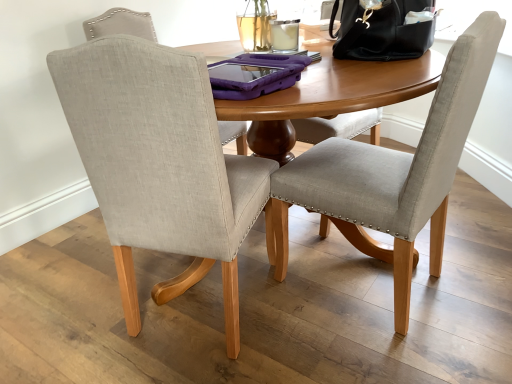
At what (x,y) coordinates should I click in order to perform the action: click on free space underneath light gray fabric chair at center, which ranks as the 1th chair in right-to-left order (from a real-world perspective). Please return your answer as a coordinate pair (x, y). Looking at the image, I should click on (366, 278).